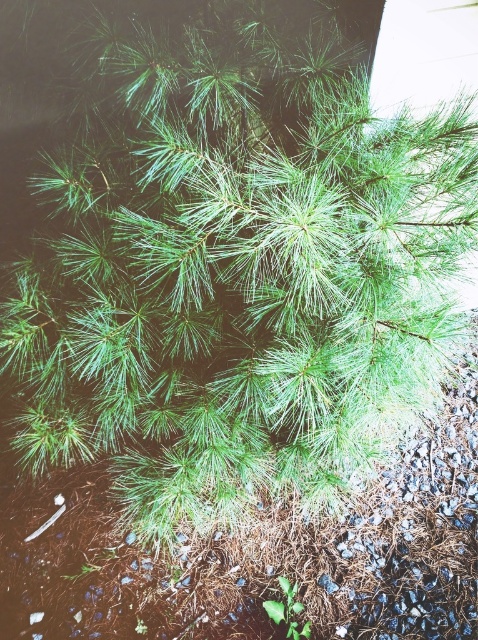
In the scene shown: Is brown mulch at center closer to camera compared to green leafy plant at bottom?

Yes, brown mulch at center is closer to the viewer.

Between point (182, 586) and point (300, 624), which one is positioned behind?

The point (182, 586) is more distant.

What do you see at coordinates (259, 552) in the screenshot? The image size is (478, 640). I see `brown mulch at center` at bounding box center [259, 552].

You are a GUI agent. You are given a task and a screenshot of the screen. Output one action in this format:
    pyautogui.click(x=<x>, y=<y>)
    Task: Click on the brown mulch at center
    This screenshot has width=478, height=640.
    Given the screenshot: What is the action you would take?
    259,552